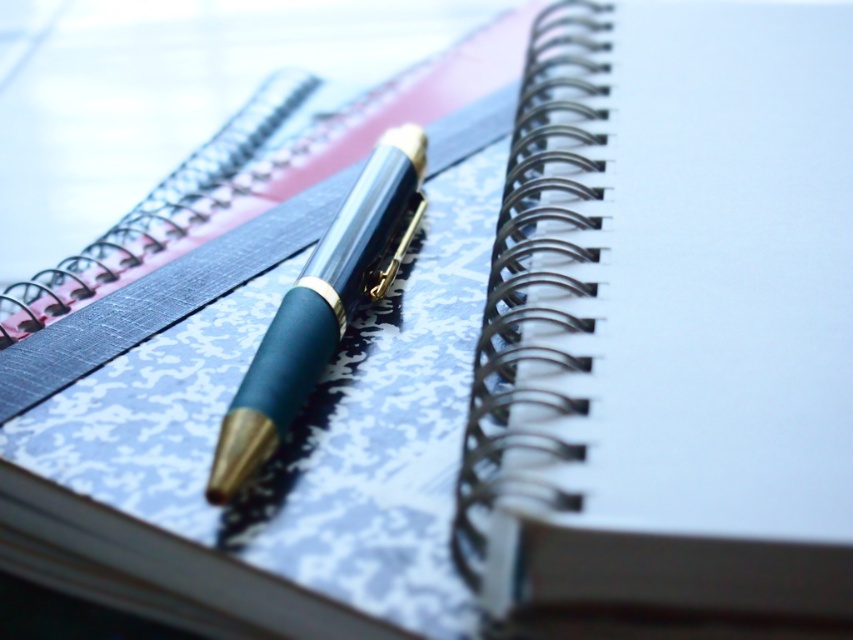
You are organizing a desk and need to place the satin silver journal at upper left and the matte blue pen at center into a drawer. The drawer has a height limit of 10 cm. Can both items fit vertically without bending or damaging them?

The satin silver journal at upper left is much taller than the matte blue pen at center. Since the drawer has a 10 cm height limit, the journal may exceed this height, making it difficult to fit vertically without bending or damaging it. The pen should fit, but the journal might not.

You are organizing a desk and need to place the satin silver journal at upper left and the matte blue pen at center. According to the image, where should you place the satin silver journal relative to the matte blue pen?

The satin silver journal at upper left is positioned on the right side of the matte blue pen at center, so you should place the satin silver journal to the right of the matte blue pen.